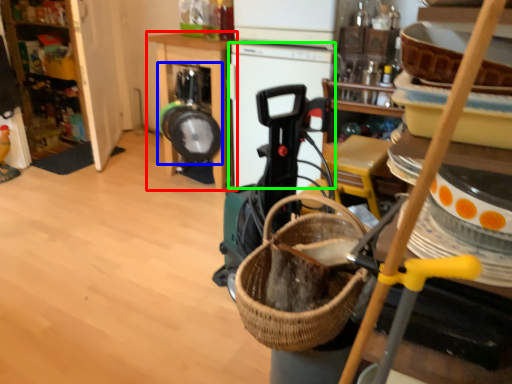
Question: Considering the real-world distances, which object is closest to furniture (highlighted by a red box)? appliance (highlighted by a blue box) or appliance (highlighted by a green box).

Choices:
 (A) appliance
 (B) appliance

Answer: (A)